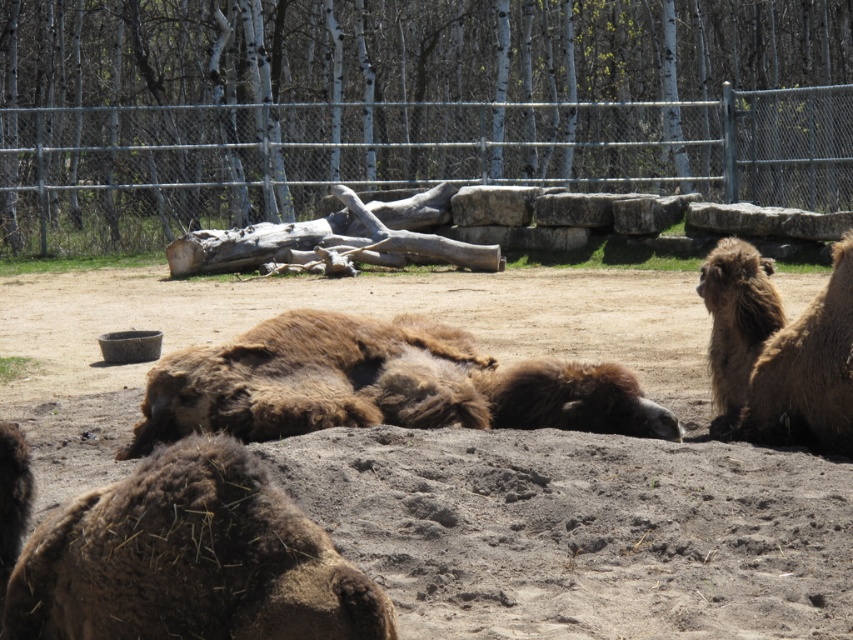
Is metallic chain-link fence at upper center further to the viewer compared to brown fuzzy camel at center?

Yes, it is behind brown fuzzy camel at center.

Does point (26, 112) come closer to viewer compared to point (143, 397)?

No, (26, 112) is behind (143, 397).

Identify the location of metallic chain-link fence at upper center. The height and width of the screenshot is (640, 853). (393, 157).

Is point (35, 380) farther from viewer compared to point (305, 321)?

Yes, it is behind point (305, 321).

The width and height of the screenshot is (853, 640). In order to click on brown sandy dirt at center in this screenshot , I will do (x=480, y=456).

Can you confirm if brown sandy dirt at center is positioned below metallic chain-link fence at upper center?

Yes, brown sandy dirt at center is below metallic chain-link fence at upper center.

Can you confirm if brown sandy dirt at center is positioned above metallic chain-link fence at upper center?

Actually, brown sandy dirt at center is below metallic chain-link fence at upper center.

Where is `brown sandy dirt at center`? The height and width of the screenshot is (640, 853). brown sandy dirt at center is located at coordinates (480, 456).

At what (x,y) coordinates should I click in order to perform the action: click on brown sandy dirt at center. Please return your answer as a coordinate pair (x, y). The image size is (853, 640). Looking at the image, I should click on (480, 456).